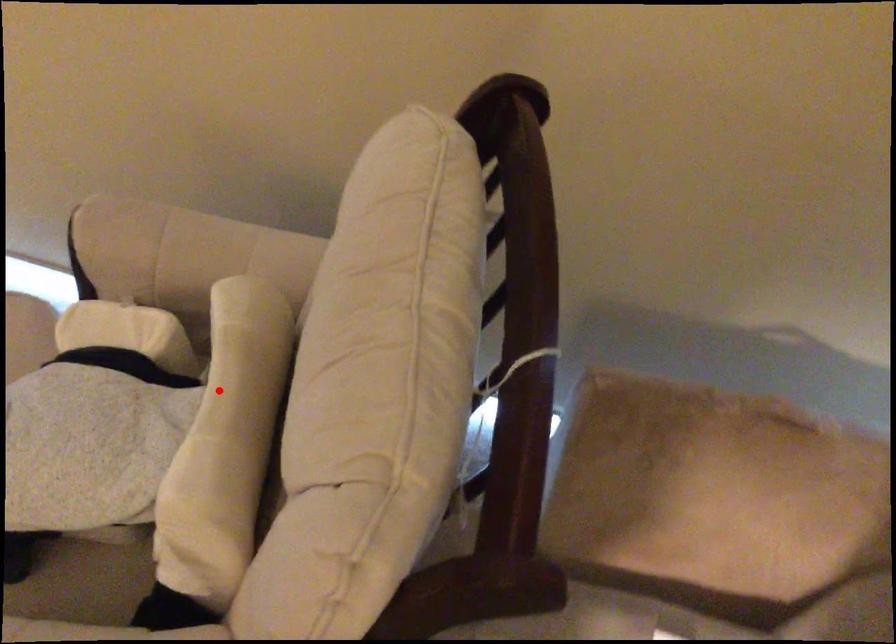
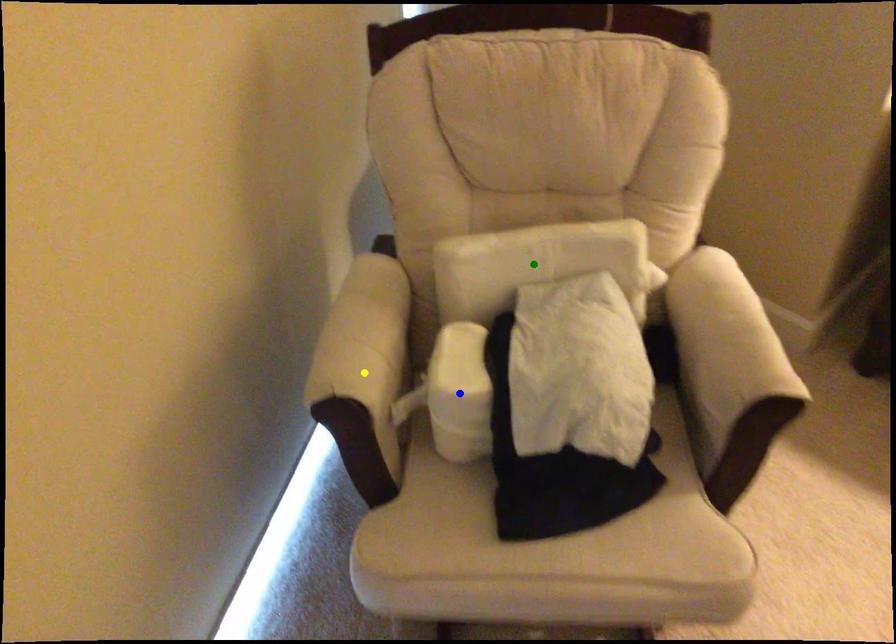
Question: I am providing you with two images of the same scene from different viewpoints. A red point is marked on the first image. You are given multiple points on the second image. Which spot in image 2 lines up with the point in image 1?

Choices:
 (A) green point
 (B) yellow point
 (C) blue point

Answer: (A)